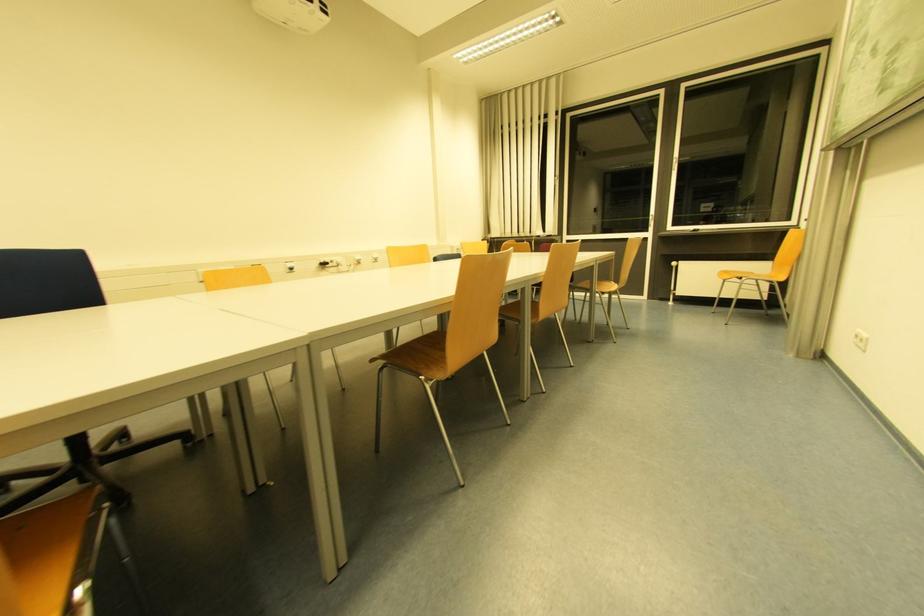
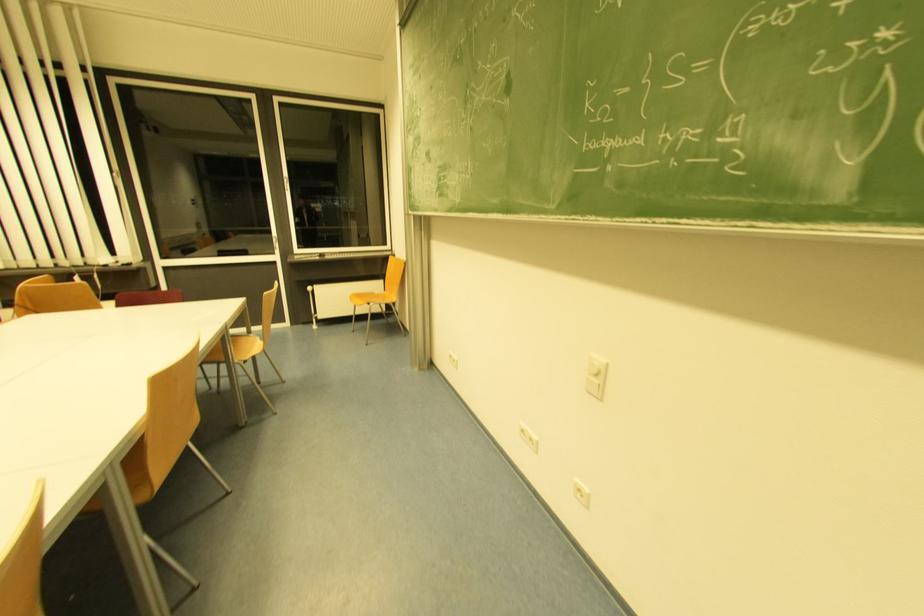
Question: The camera is either moving clockwise (left) or counter-clockwise (right) around the object. The first image is from the beginning of the video and the second image is from the end. Is the camera moving left or right when shooting the video?

Choices:
 (A) Left
 (B) Right

Answer: (A)